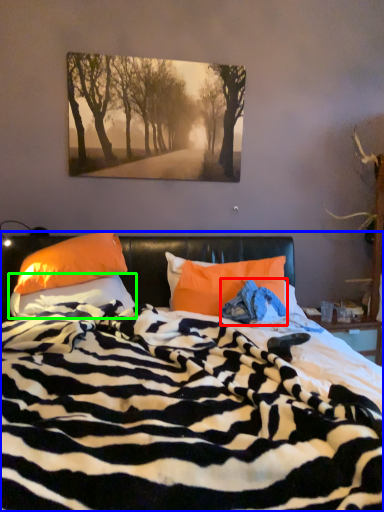
Question: Which object is positioned farthest from material (highlighted by a red box)? Select from bed (highlighted by a blue box) and pillow (highlighted by a green box).

Choices:
 (A) bed
 (B) pillow

Answer: (B)